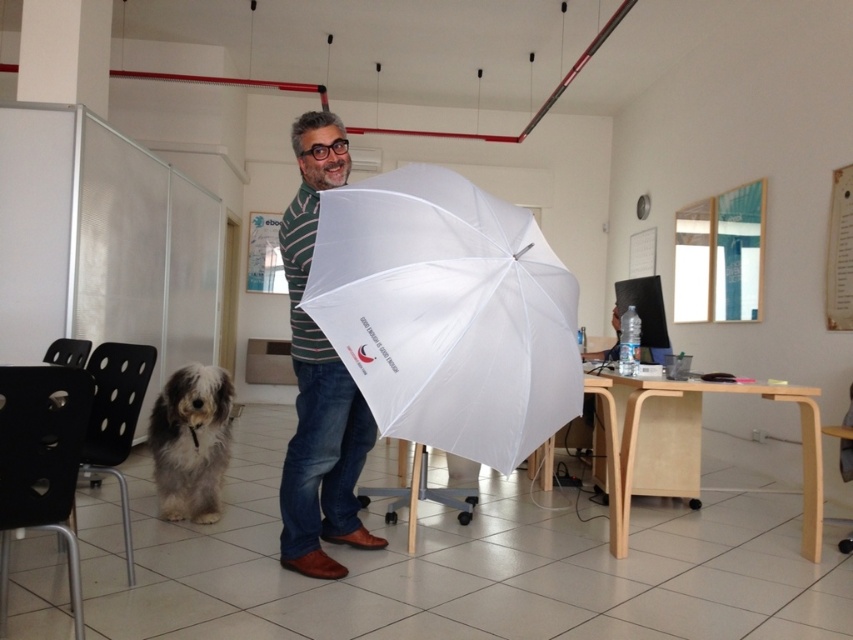
You are standing in the office and need to reach the white matte umbrella at center. What is the shortest path you can take without crossing any furniture or equipment?

The shortest path to the white matte umbrella at center would be to move directly towards it from your current position, as it is located at the center of the scene with no furniture or equipment blocking the path according to the coordinates provided.

You are a photographer trying to focus on the striped cotton shirt at center. However, the white matte umbrella at center is blocking your view. Can you move the umbrella to the side to get a clear shot of the shirt?

The white matte umbrella at center is closer to the viewer than the striped cotton shirt at center, so moving the umbrella would allow the photographer to see the striped cotton shirt at center clearly.